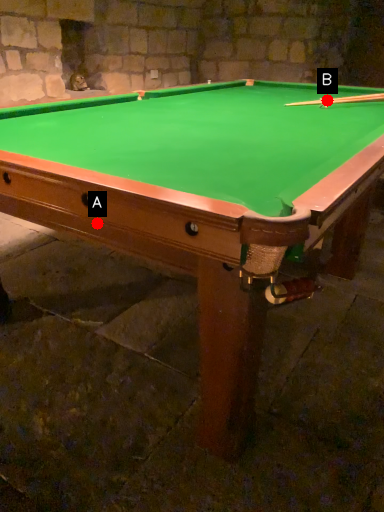
Question: Two points are circled on the image, labeled by A and B beside each circle. Which point appears closest to the camera in this image?

Choices:
 (A) A is closer
 (B) B is closer

Answer: (A)